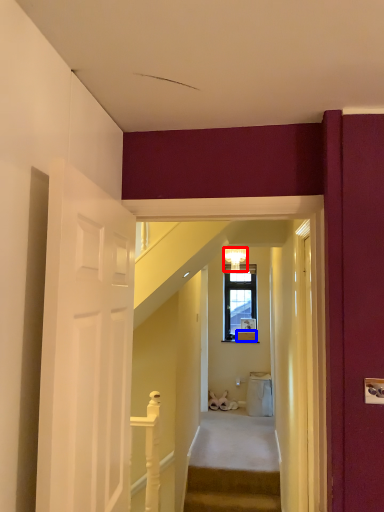
Question: Which object is further to the camera taking this photo, lamp (highlighted by a red box) or box (highlighted by a blue box)?

Choices:
 (A) lamp
 (B) box

Answer: (B)